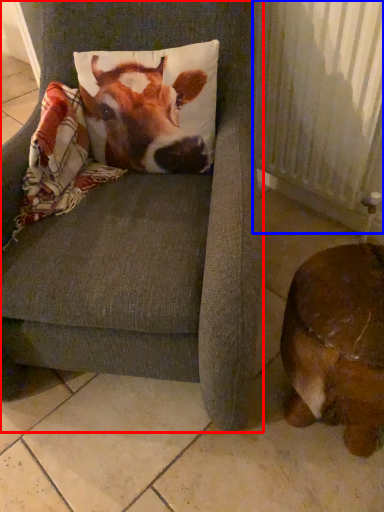
Question: Which of the following is the farthest to the observer, chair (highlighted by a red box) or radiator (highlighted by a blue box)?

Choices:
 (A) chair
 (B) radiator

Answer: (B)